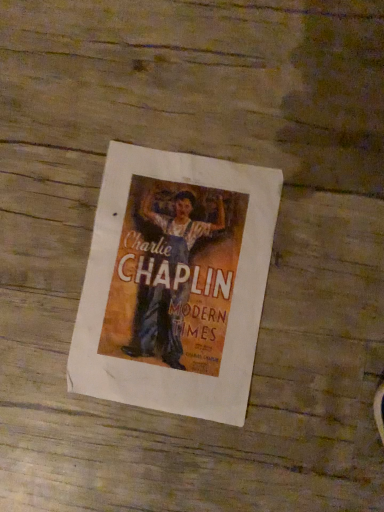
Where is `matte paper poster at center`? The height and width of the screenshot is (512, 384). matte paper poster at center is located at coordinates (175, 283).

Describe the element at coordinates (175, 283) in the screenshot. I see `matte paper poster at center` at that location.

Where is `matte paper poster at center`? This screenshot has width=384, height=512. matte paper poster at center is located at coordinates (175, 283).